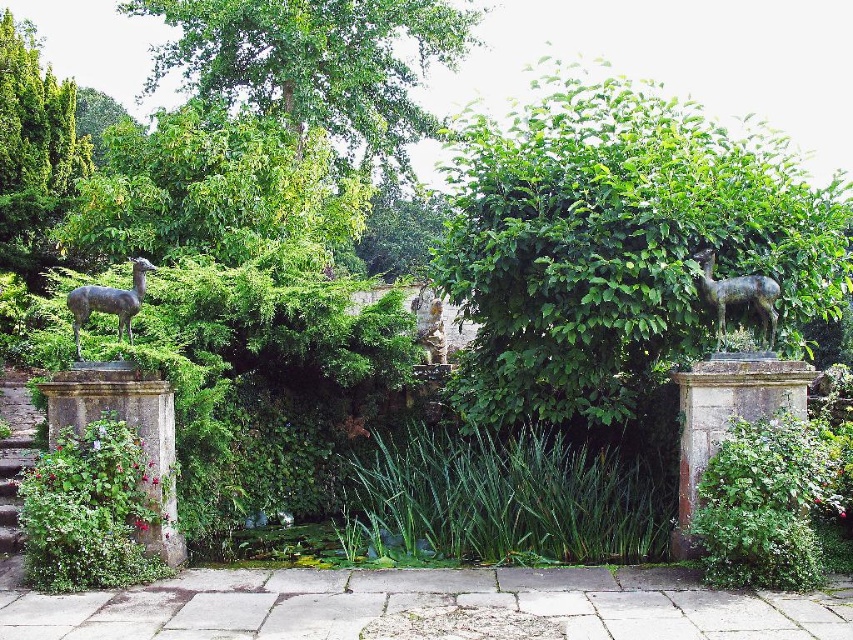
Based on the photo, is shiny bronze deer at right above bronze statue at left?

Yes, shiny bronze deer at right is above bronze statue at left.

Between point (711, 284) and point (77, 292), which one is positioned in front?

Point (77, 292) is more forward.

This screenshot has height=640, width=853. What are the coordinates of `shiny bronze deer at right` in the screenshot? It's located at (738, 296).

Is green leafy tree at upper center wider than shiny bronze deer at right?

Yes, green leafy tree at upper center is wider than shiny bronze deer at right.

Is green leafy tree at upper center to the left of shiny bronze deer at right from the viewer's perspective?

Yes, green leafy tree at upper center is to the left of shiny bronze deer at right.

Which is behind, point (363, 106) or point (766, 276)?

The point (363, 106) is more distant.

This screenshot has height=640, width=853. In order to click on green leafy tree at upper center in this screenshot , I will do `click(315, 60)`.

Is green leafy bush at center to the right of bronze statue at left from the viewer's perspective?

Correct, you'll find green leafy bush at center to the right of bronze statue at left.

Is green leafy bush at center thinner than bronze statue at left?

Incorrect, green leafy bush at center's width is not less than bronze statue at left's.

Image resolution: width=853 pixels, height=640 pixels. In order to click on green leafy bush at center in this screenshot , I will do `click(618, 243)`.

Image resolution: width=853 pixels, height=640 pixels. I want to click on green leafy bush at center, so [618, 243].